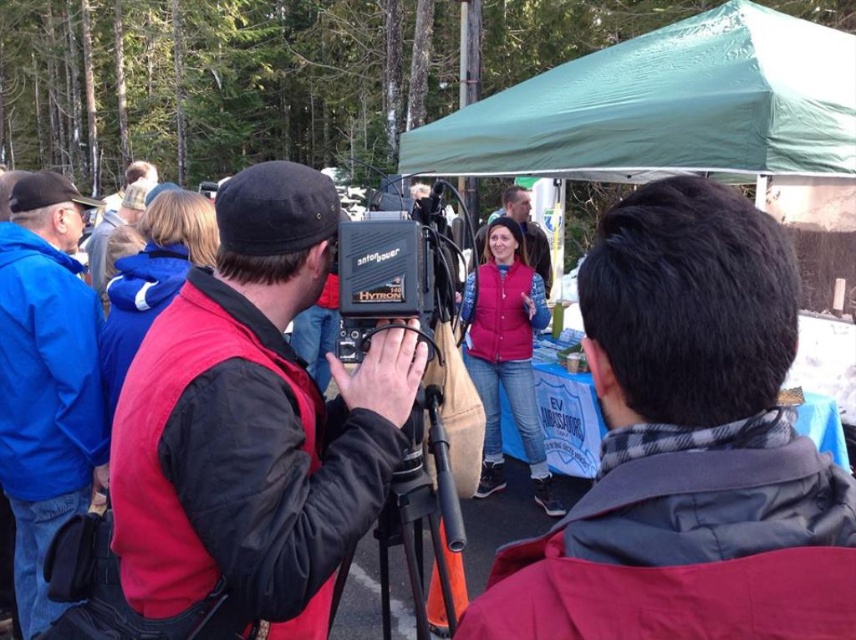
Who is taller, blue fleece jacket at left or matte black vest at center?

Standing taller between the two is blue fleece jacket at left.

Is point (45, 358) closer to camera compared to point (513, 209)?

That is True.

At what (x,y) coordinates should I click in order to perform the action: click on blue fleece jacket at left. Please return your answer as a coordinate pair (x, y). This screenshot has width=856, height=640. Looking at the image, I should click on (46, 380).

Between black matte tripod at center and matte black vest at center, which one has more height?

matte black vest at center is taller.

Who is higher up, black matte tripod at center or matte black vest at center?

matte black vest at center is higher up.

Is point (447, 593) positioned before point (504, 195)?

That is True.

This screenshot has width=856, height=640. I want to click on black matte tripod at center, so click(x=421, y=524).

Between point (627, 163) and point (438, 516), which one is positioned behind?

The point (627, 163) is more distant.

Is point (789, 81) closer to camera compared to point (432, 410)?

No, (789, 81) is behind (432, 410).

The width and height of the screenshot is (856, 640). What are the coordinates of `green fabric canopy at upper center` in the screenshot? It's located at (664, 108).